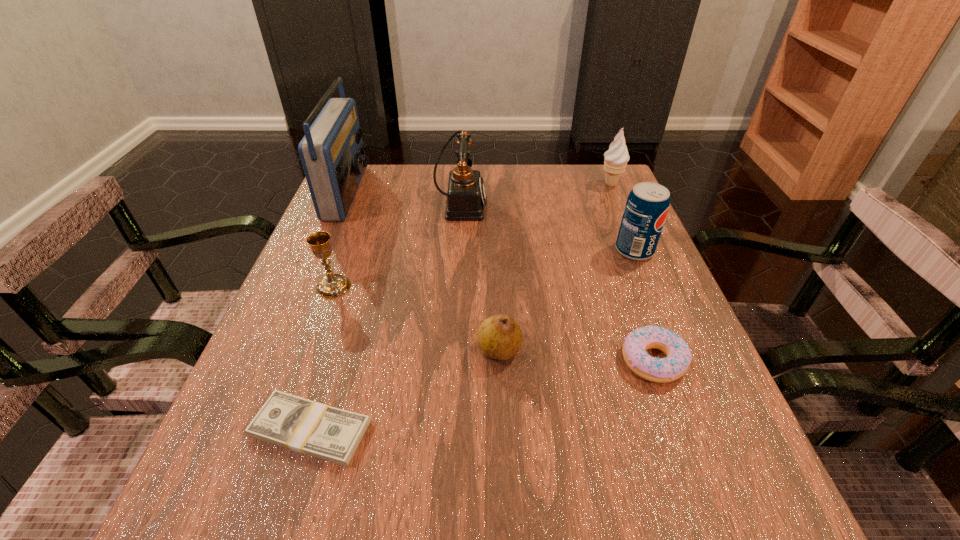
In the image, there is a desktop. Where is `free space at the near edge`? free space at the near edge is located at coordinates (573, 535).

Where is `free space at the left edge`? free space at the left edge is located at coordinates (309, 295).

I want to click on free space at the right edge, so click(x=605, y=215).

Identify the location of vacant point at the far right corner. (566, 167).

The image size is (960, 540). I want to click on vacant space at the near right corner of the desktop, so click(667, 531).

I want to click on free point between the tallest object and the pear, so click(423, 271).

The width and height of the screenshot is (960, 540). Find the location of `free space between the fourth nearest object and the telephone`. free space between the fourth nearest object and the telephone is located at coordinates (396, 246).

Where is `free space between the fourth shortest object and the icecream`? This screenshot has height=540, width=960. free space between the fourth shortest object and the icecream is located at coordinates (472, 235).

Locate an element on the screen. The width and height of the screenshot is (960, 540). blank region between the radio receiver and the doughnut is located at coordinates (501, 276).

You are a GUI agent. You are given a task and a screenshot of the screen. Output one action in this format:
    pyautogui.click(x=<x>, y=<y>)
    Task: Click on the empty space between the tallest object and the pop
    
    Given the screenshot: What is the action you would take?
    (491, 221)